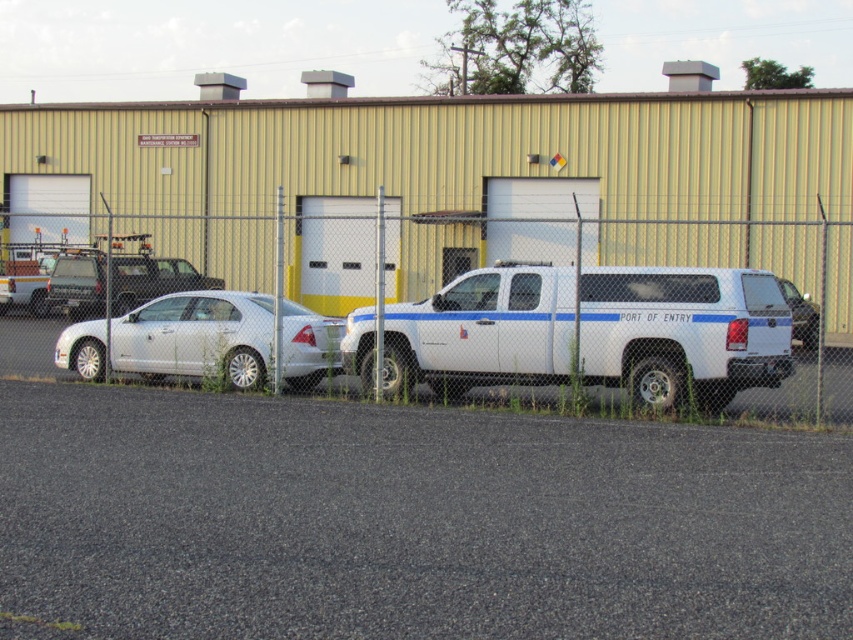
You are standing at the fence and want to walk directly to the point labeled point (144, 321). However, there is an obstacle at point point (573, 285). Will you encounter this obstacle before reaching your destination?

Yes, you will encounter the obstacle at point (573, 285) before reaching point (144, 321) because point (573, 285) is in front of point (144, 321).